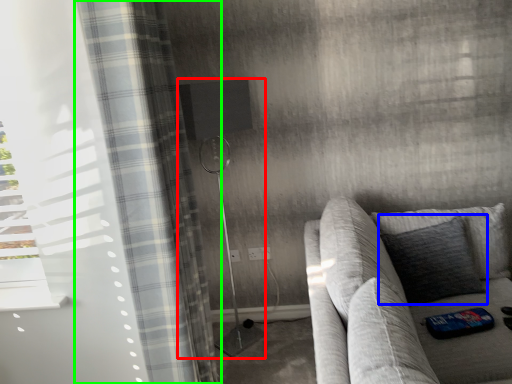
Question: Considering the real-world distances, which object is closest to shower (highlighted by a red box)? pillow (highlighted by a blue box) or curtain (highlighted by a green box).

Choices:
 (A) pillow
 (B) curtain

Answer: (B)